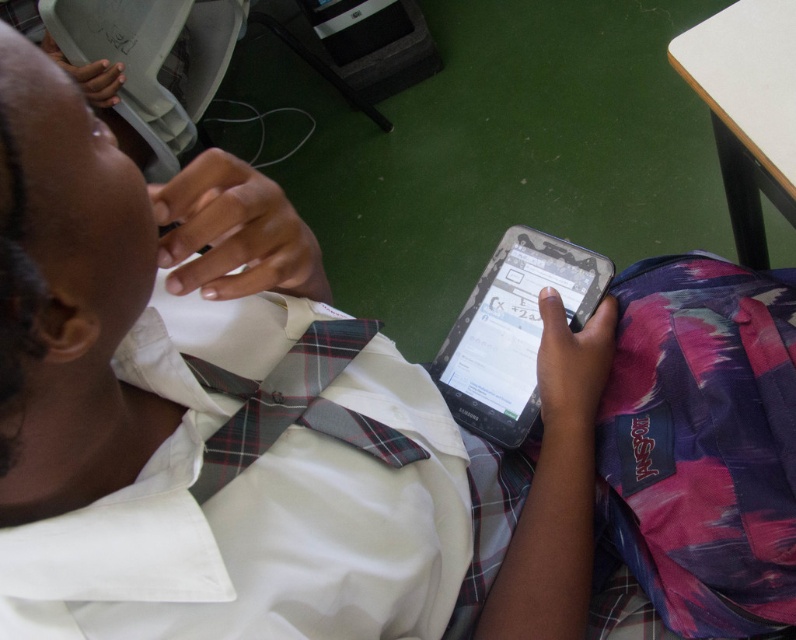
Can you confirm if black matte tablet at center is shorter than plaid fabric tie at center?

In fact, black matte tablet at center may be taller than plaid fabric tie at center.

Between black matte tablet at center and plaid fabric tie at center, which one is positioned higher?

black matte tablet at center is above.

Is point (523, 396) less distant than point (244, 400)?

No.

The image size is (796, 640). Identify the location of black matte tablet at center. (513, 330).

Is white plastic table at upper right positioned in front of black matte tablet at center?

Yes, white plastic table at upper right is in front of black matte tablet at center.

Does point (752, 128) come in front of point (594, 257)?

Yes, point (752, 128) is closer to viewer.

Identify the location of white plastic table at upper right. (747, 108).

Does white plastic table at upper right have a lesser height compared to plaid fabric tie at center?

No, white plastic table at upper right is not shorter than plaid fabric tie at center.

Does point (746, 81) come closer to viewer compared to point (346, 323)?

No.

Between point (791, 26) and point (373, 419), which one is positioned in front?

Point (373, 419) is more forward.

You are a GUI agent. You are given a task and a screenshot of the screen. Output one action in this format:
    pyautogui.click(x=<x>, y=<y>)
    Task: Click on the white plastic table at upper right
    
    Given the screenshot: What is the action you would take?
    pyautogui.click(x=747, y=108)